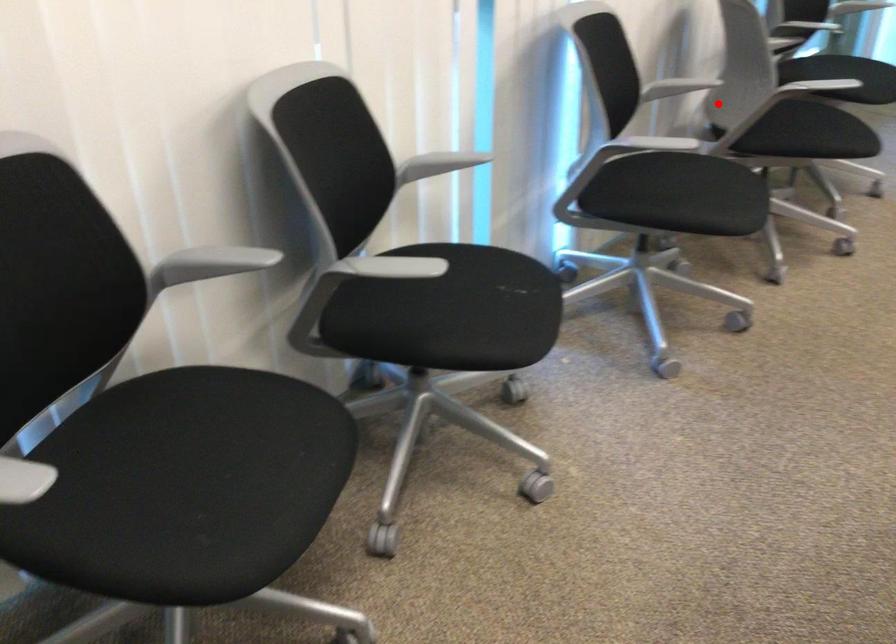
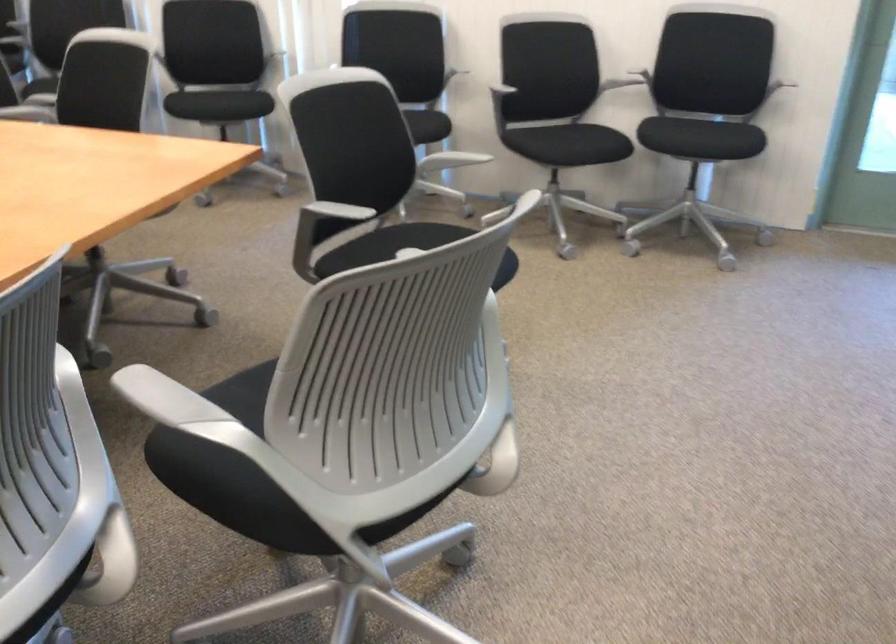
Locate, in the second image, the point that corresponds to the highlighted location in the first image.

(510, 96)